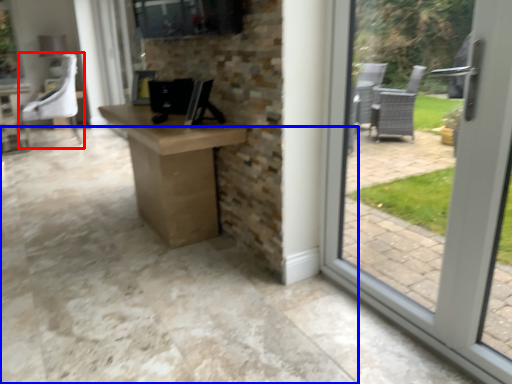
Question: Among these objects, which one is farthest to the camera, chair (highlighted by a red box) or concrete (highlighted by a blue box)?

Choices:
 (A) chair
 (B) concrete

Answer: (A)